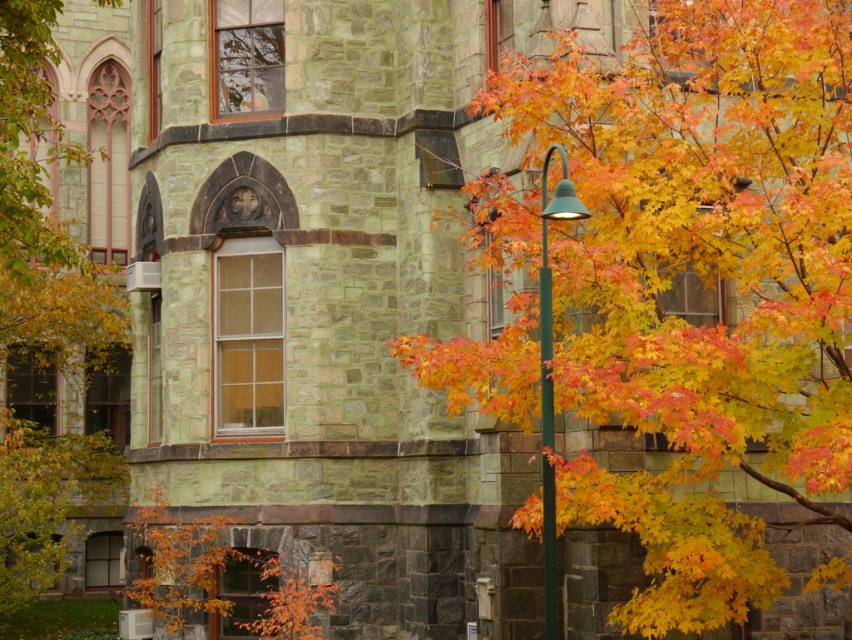
You are standing in front of the stone building and notice the autumn leaves at left and the green metallic pole at center. Which object is taller?

The autumn leaves at left has a greater height compared to the green metallic pole at center, so the autumn leaves at left is taller.

You are an architect analyzing the symmetry of the building. You notice two clusters of autumn leaves at right and autumn leaves at left. Which cluster is smaller in size?

The autumn leaves at right is smaller than autumn leaves at left.

You are standing in front of the stone building with autumn foliage. There are two points marked on the image, point 1 at coordinates point (50, 442) and point 2 at coordinates point (567, 193). Which point is closer to you?

Point (50, 442) is closer to you because it is further to the viewer than point (567, 193).